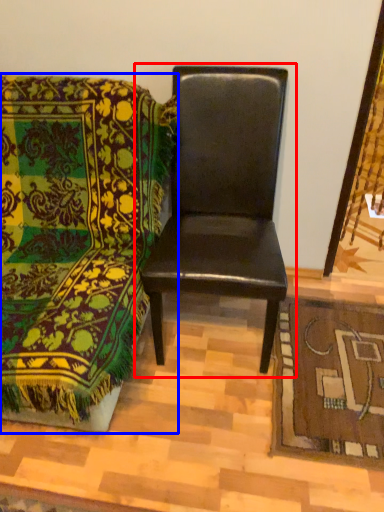
Question: Which object appears farthest to the camera in this image, chair (highlighted by a red box) or chair (highlighted by a blue box)?

Choices:
 (A) chair
 (B) chair

Answer: (A)